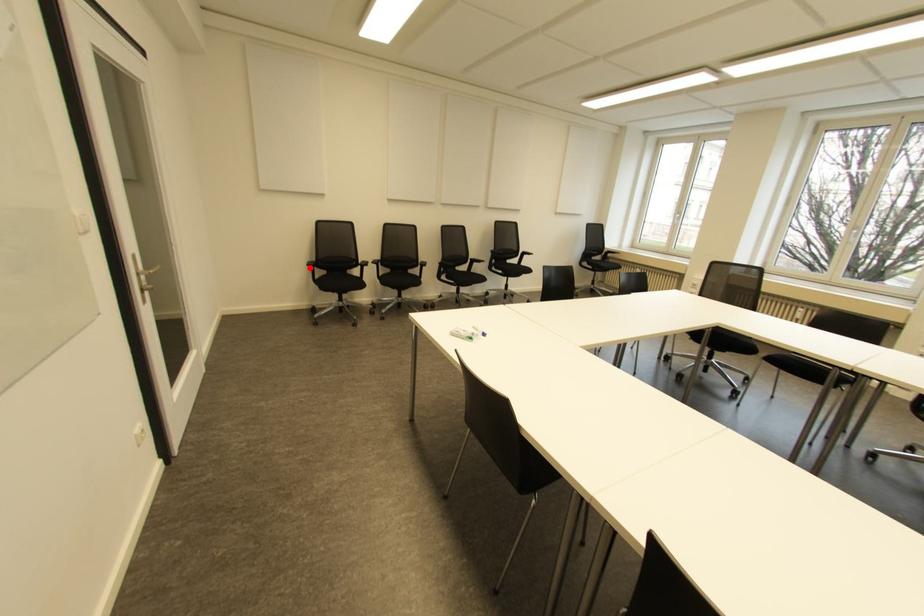
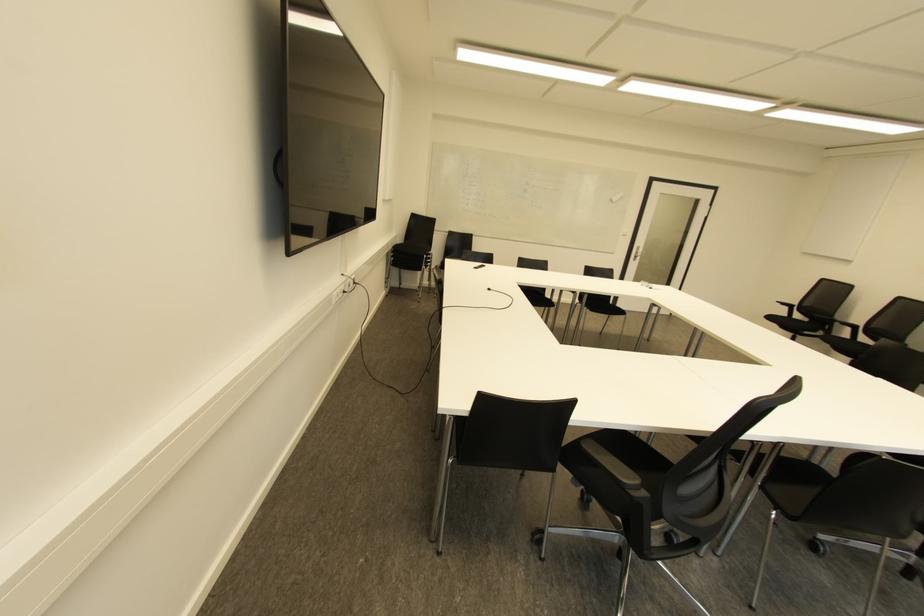
Question: I am providing you with two images of the same scene from different viewpoints. A red point is shown in image1. For the corresponding object point in image2, is it positioned nearer or farther from the camera?

Choices:
 (A) Nearer
 (B) Farther

Answer: (B)